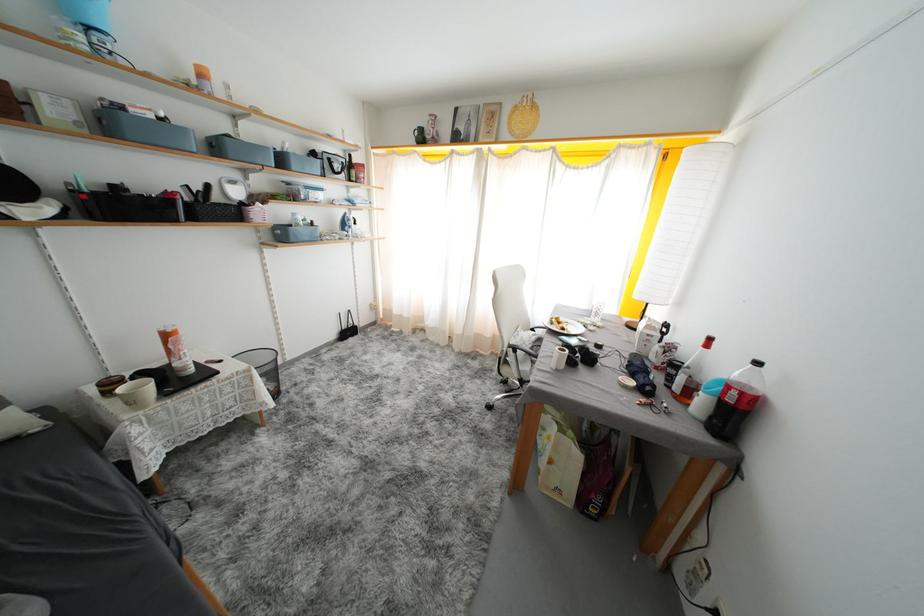
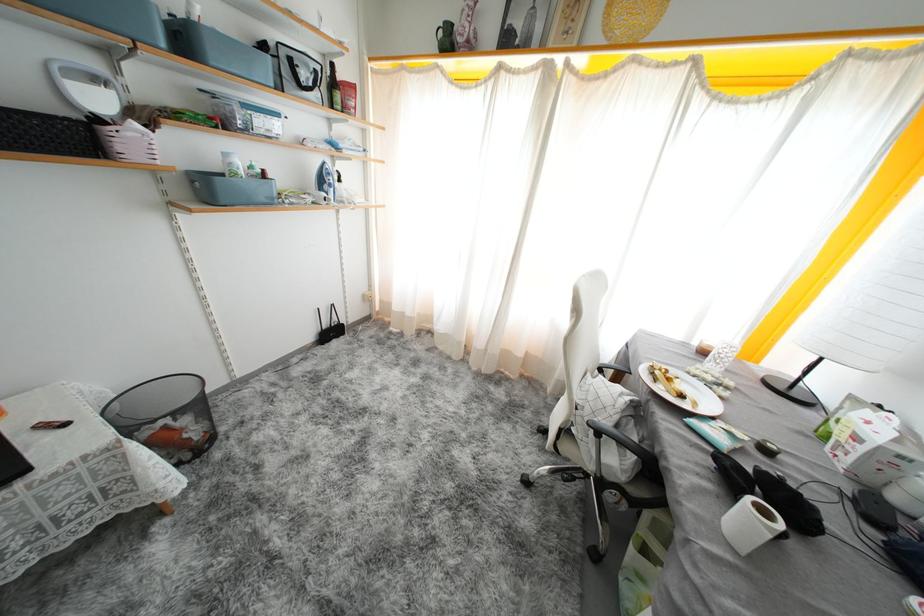
Locate, in the second image, the point that corresponds to (604,351) in the first image.

(773, 455)